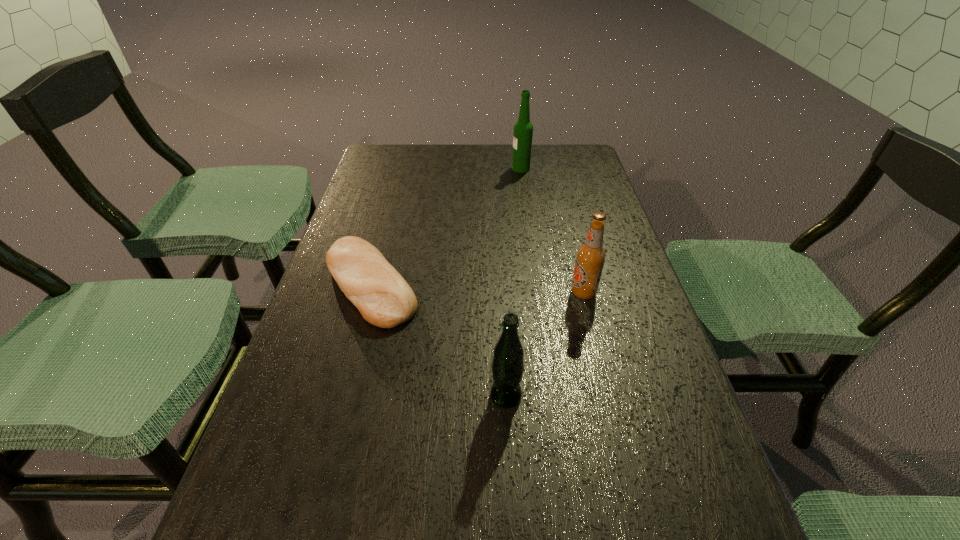
Identify the location of the farthest object. The image size is (960, 540). (523, 129).

You are a GUI agent. You are given a task and a screenshot of the screen. Output one action in this format:
    pyautogui.click(x=<x>, y=<y>)
    Task: Click on the farthest beer bottle
    
    Given the screenshot: What is the action you would take?
    pyautogui.click(x=523, y=129)

The height and width of the screenshot is (540, 960). Find the location of `the rightmost object`. the rightmost object is located at coordinates (590, 257).

Where is `the rightmost beer bottle`? This screenshot has height=540, width=960. the rightmost beer bottle is located at coordinates (590, 257).

Find the location of a particular element. the nearest object is located at coordinates (507, 366).

Find the location of a particular element. This screenshot has height=540, width=960. the nearest beer bottle is located at coordinates (507, 366).

The image size is (960, 540). Find the location of `the shortest object`. the shortest object is located at coordinates click(x=383, y=297).

Find the location of `bread`. bread is located at coordinates (383, 297).

You are a GUI agent. You are given a task and a screenshot of the screen. Output one action in this format:
    pyautogui.click(x=<x>, y=<y>)
    Task: Click on the free space located on the label of the farthest beer bottle
    The width and height of the screenshot is (960, 540).
    Given the screenshot: What is the action you would take?
    pyautogui.click(x=491, y=168)

Find the location of a particular element. This screenshot has height=540, width=960. vacant region located on the label of the farthest beer bottle is located at coordinates (469, 168).